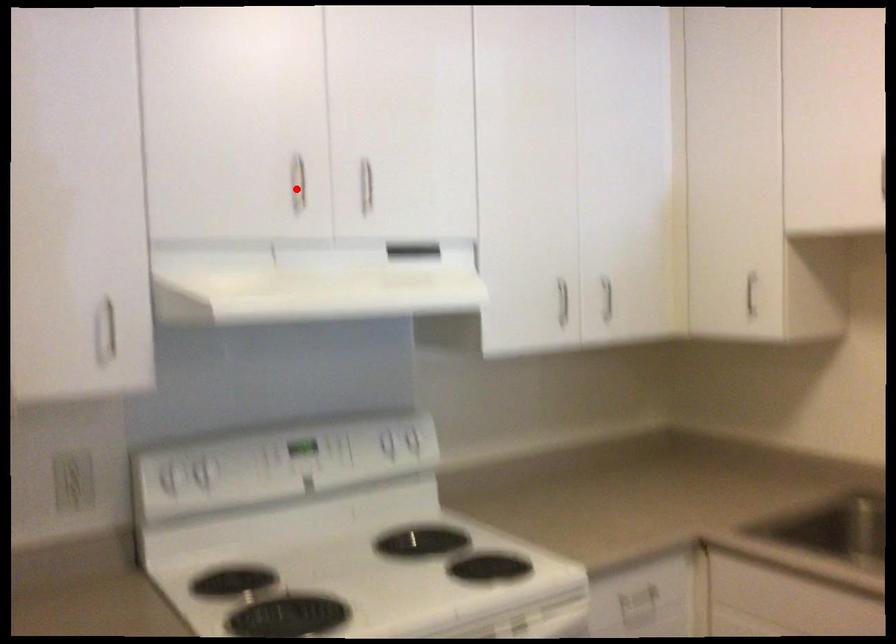
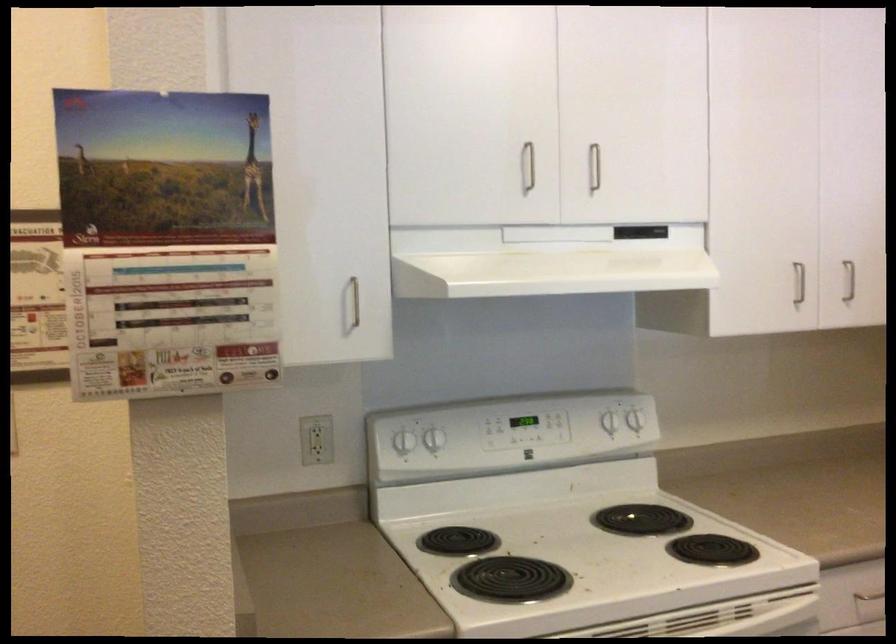
Locate, in the second image, the point that corresponds to the highlighted location in the first image.

(528, 166)